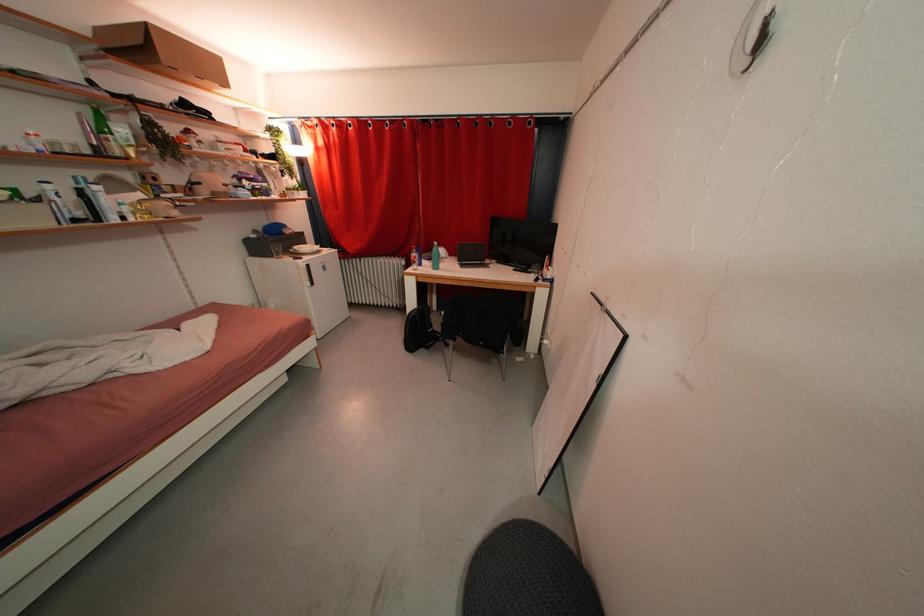
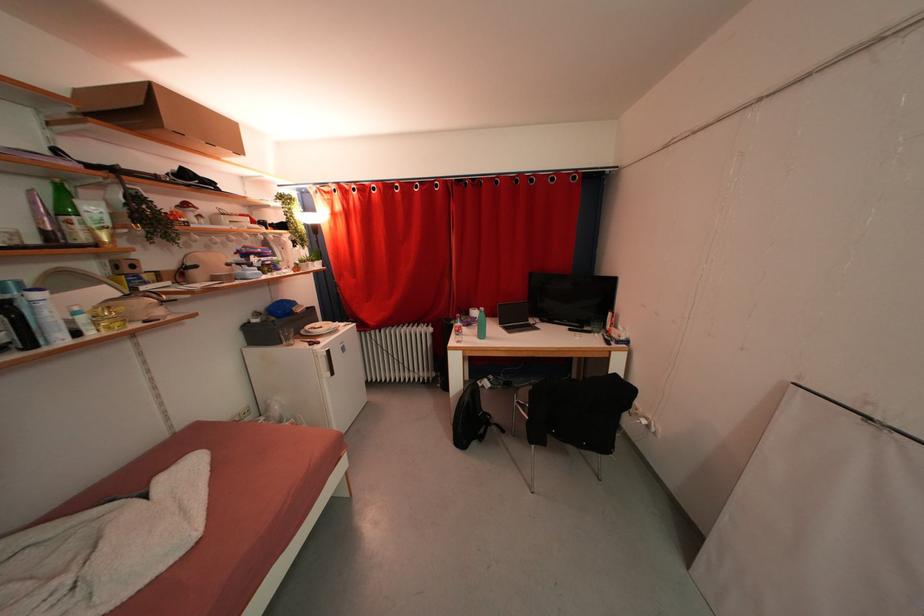
Question: The images are taken continuously from a first-person perspective. In which direction is your viewpoint rotating?

Choices:
 (A) Left
 (B) Right
 (C) Up
 (D) Down

Answer: (C)